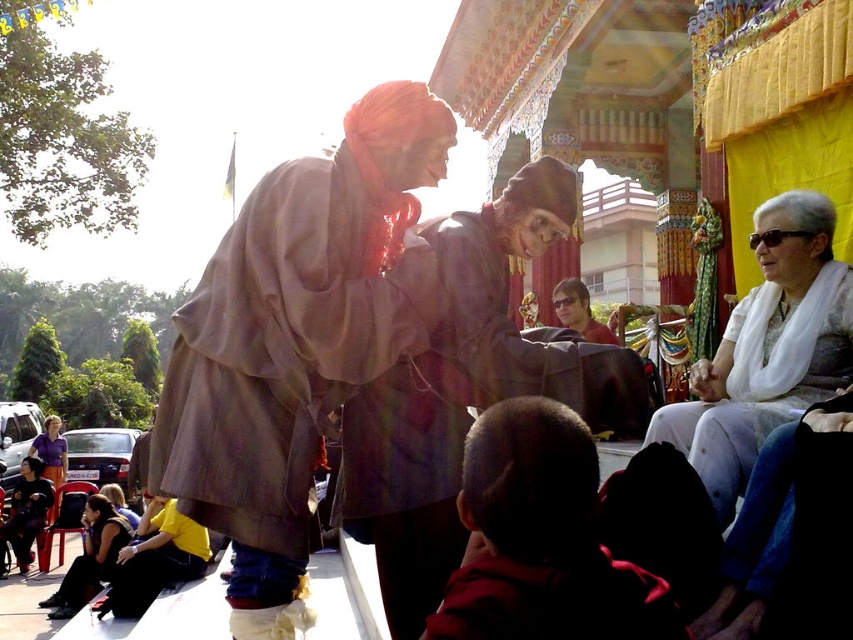
You are an event photographer at the cultural event. You need to capture a closeup shot of the dark blue fabric at lower left. Where exactly should you focus your camera lens to ensure the fabric is in the center of your photo?

You should focus your camera lens at point [25,516] to center the dark blue fabric at lower left in your photo.

In the scene shown: You are an event planner observing the scene and need to arrange seating based on the height of the participants. Which participant, the matte brown jacket at center or the purple cotton shirt at lower left, should be seated in a taller chair to accommodate their height?

The purple cotton shirt at lower left should be seated in a taller chair because the matte brown jacket at center has a lesser height compared to the purple cotton shirt at lower left.

From the picture: You are an observer at this event and need to determine the spatial relationship between the dark blue fabric at lower left and the matte brown jacket at center. Which object is located below the other?

The dark blue fabric at lower left is positioned under the matte brown jacket at center.